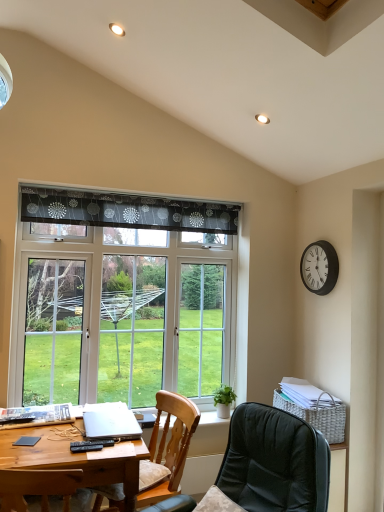
Identify the location of free location to the right of black plastic remote control at lower left, placed as the first remote control when sorted from right to left. (115, 446).